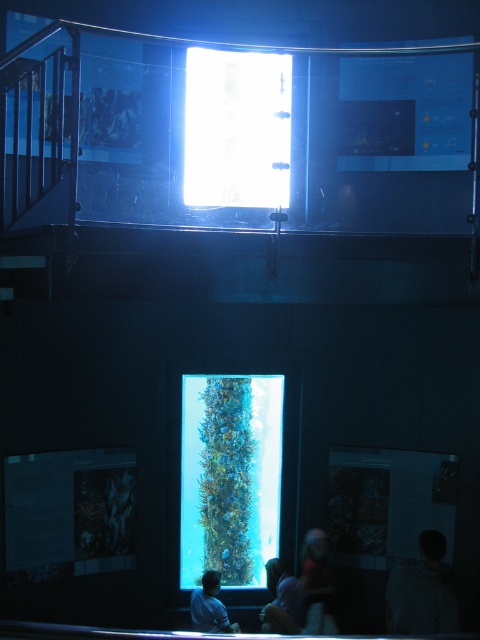
Question: Is dark gray sweater at lower right wider than light blue fabric shirt at lower center?

Choices:
 (A) no
 (B) yes

Answer: (B)

Question: Does smooth skin face at lower right have a larger size compared to light blue fabric shirt at lower center?

Choices:
 (A) no
 (B) yes

Answer: (B)

Question: Which point is closer to the camera taking this photo?

Choices:
 (A) (192, 592)
 (B) (408, 609)
 (C) (271, 621)
 (D) (302, 554)

Answer: (B)

Question: Which object is the closest to the light blue fabric at lower center?

Choices:
 (A) transparent glass projection screen at center
 (B) light blue fabric shirt at lower center
 (C) dark gray sweater at lower right

Answer: (B)

Question: From the image, what is the correct spatial relationship of transparent glass projection screen at center in relation to smooth skin face at lower right?

Choices:
 (A) left
 (B) right

Answer: (A)

Question: Which is nearer to the transparent glass projection screen at center?

Choices:
 (A) light blue fabric at lower center
 (B) smooth skin face at lower right
 (C) light blue fabric shirt at lower center
 (D) dark gray sweater at lower right

Answer: (C)